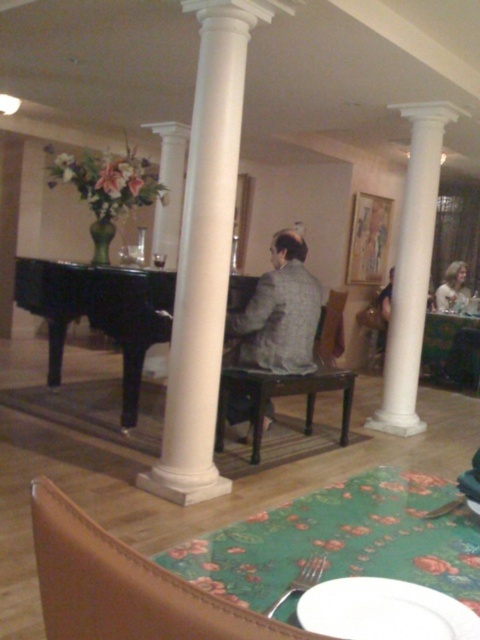
Question: Which object is positioned farthest from the black polished piano at center?

Choices:
 (A) white smooth column at right
 (B) green floral placemat at lower center

Answer: (B)

Question: Does gray woolen suit at center appear under green fabric table at lower right?

Choices:
 (A) yes
 (B) no

Answer: (B)

Question: Based on their relative distances, which object is farther from the white smooth column at right?

Choices:
 (A) blonde hair at upper right
 (B) gray woolen suit at center
 (C) green fabric table at lower right
 (D) green floral placemat at lower center

Answer: (D)

Question: Does green floral placemat at lower center lie in front of black polished piano at center?

Choices:
 (A) yes
 (B) no

Answer: (A)

Question: Among these points, which one is farthest from the camera?

Choices:
 (A) (225, 230)
 (B) (424, 108)

Answer: (B)

Question: Can you confirm if white smooth column at right is thinner than green fabric table at lower right?

Choices:
 (A) no
 (B) yes

Answer: (A)